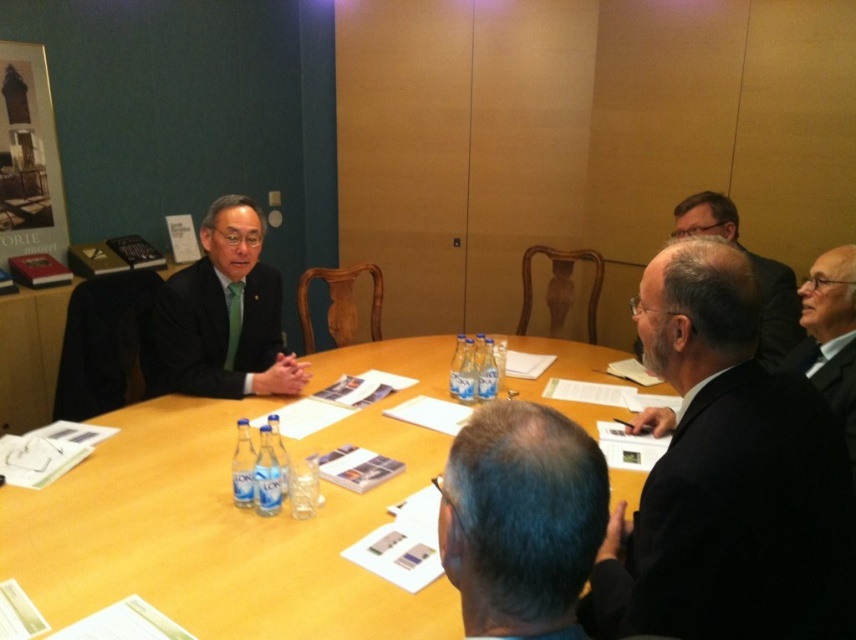
You are attending a meeting in this conference room and need to pass a document to the person wearing the black suit at center. Since you are seated at the wooden table at center, which direction should you move to reach them?

The black suit at center is to the right of the wooden table at center, so you should move to your right to reach them.

You are a photographer standing in front of the meeting table. You want to take a closeup photo of the gray hair at center without moving any objects. Can you get close enough to capture it clearly?

The gray hair at center is 26.69 inches away from the viewer. Since 26.69 inches is approximately 68 cm, which is a reasonable distance for a closeup photo, yes, you can get close enough to capture the gray hair at center clearly.